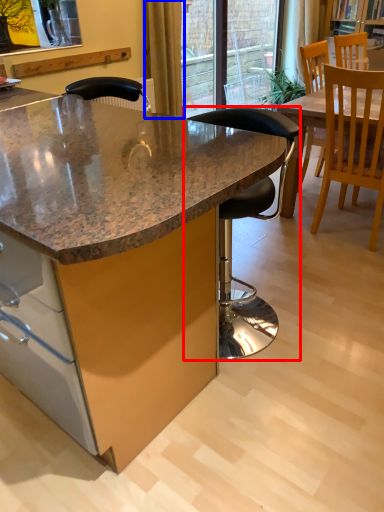
Question: Among these objects, which one is nearest to the camera, chair (highlighted by a red box) or curtain (highlighted by a blue box)?

Choices:
 (A) chair
 (B) curtain

Answer: (A)